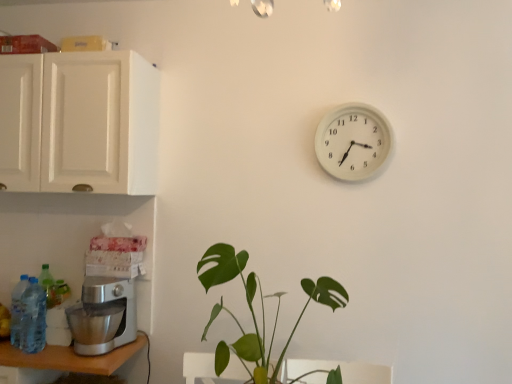
You are a GUI agent. You are given a task and a screenshot of the screen. Output one action in this format:
    pyautogui.click(x=<x>, y=<y>)
    Task: Click on the free spot to the right of blue plastic bottle at lower left, acting as the 2th bottle starting from the left
    The image size is (512, 384).
    Given the screenshot: What is the action you would take?
    pyautogui.click(x=64, y=356)